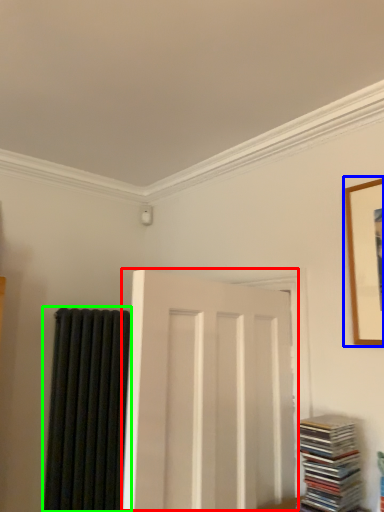
Question: Which object is the closest to the door (highlighted by a red box)? Choose among these: picture frame (highlighted by a blue box) or curtain (highlighted by a green box).

Choices:
 (A) picture frame
 (B) curtain

Answer: (A)